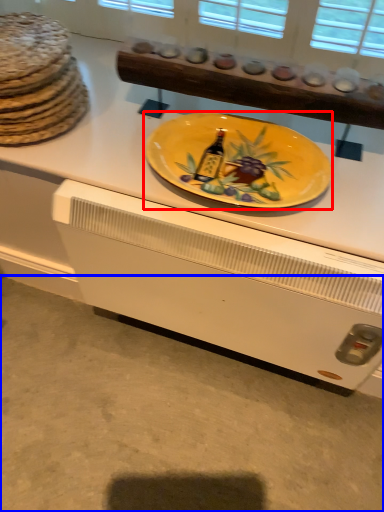
Question: Which point is further to the camera, plate (highlighted by a red box) or concrete (highlighted by a blue box)?

Choices:
 (A) plate
 (B) concrete

Answer: (B)